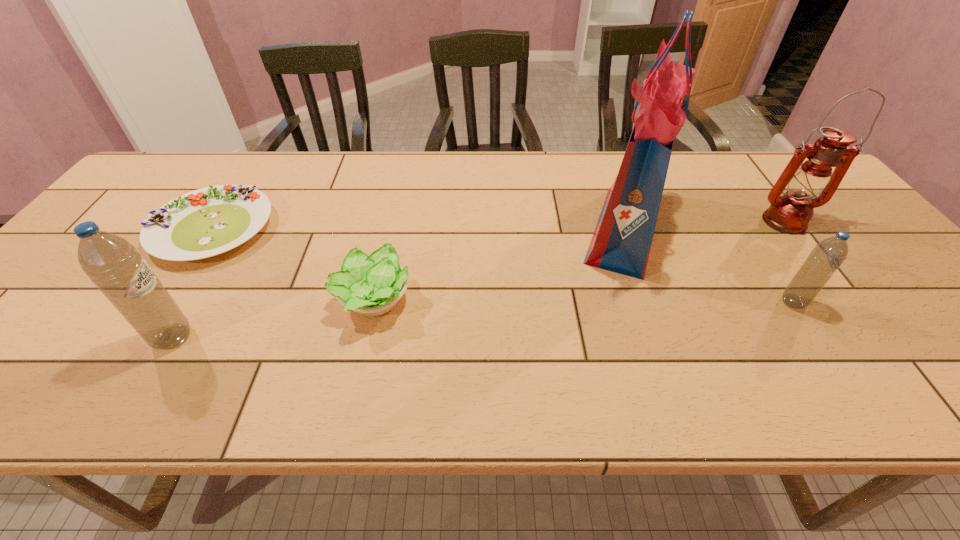
You are a GUI agent. You are given a task and a screenshot of the screen. Output one action in this format:
    pyautogui.click(x=<x>, y=<y>)
    Task: Click on the lettuce
    
    Given the screenshot: What is the action you would take?
    pyautogui.click(x=372, y=285)

Identify the location of vacant region located on the right of the nearer water bottle. (370, 338).

You are a GUI agent. You are given a task and a screenshot of the screen. Output one action in this format:
    pyautogui.click(x=<x>, y=<y>)
    Task: Click on the vacant space situated 0.140m on the right of the third shortest object
    
    Given the screenshot: What is the action you would take?
    pyautogui.click(x=868, y=302)

Where is `vacant space located on the front-facing side of the grocery bag`? vacant space located on the front-facing side of the grocery bag is located at coordinates (446, 229).

The height and width of the screenshot is (540, 960). I want to click on free location located on the front-facing side of the grocery bag, so click(x=440, y=229).

The height and width of the screenshot is (540, 960). Find the location of `free space located on the front-facing side of the grocery bag`. free space located on the front-facing side of the grocery bag is located at coordinates (489, 229).

Find the location of a particular element. The image size is (960, 540). vacant space situated on the right of the fifth shortest object is located at coordinates pos(853,221).

Identify the location of free location located 0.240m on the back of the shortest object. (263, 151).

Image resolution: width=960 pixels, height=540 pixels. I want to click on vacant space situated 0.320m on the left of the fourth object from right to left, so click(x=194, y=301).

Find the location of a particular element. grocery bag at the far edge is located at coordinates (621, 243).